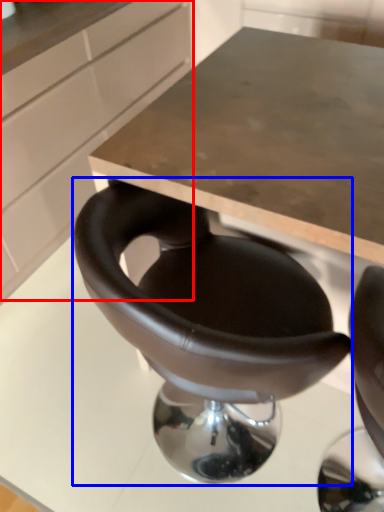
Question: Which object appears farthest to the camera in this image, cabinetry (highlighted by a red box) or chair (highlighted by a blue box)?

Choices:
 (A) cabinetry
 (B) chair

Answer: (A)